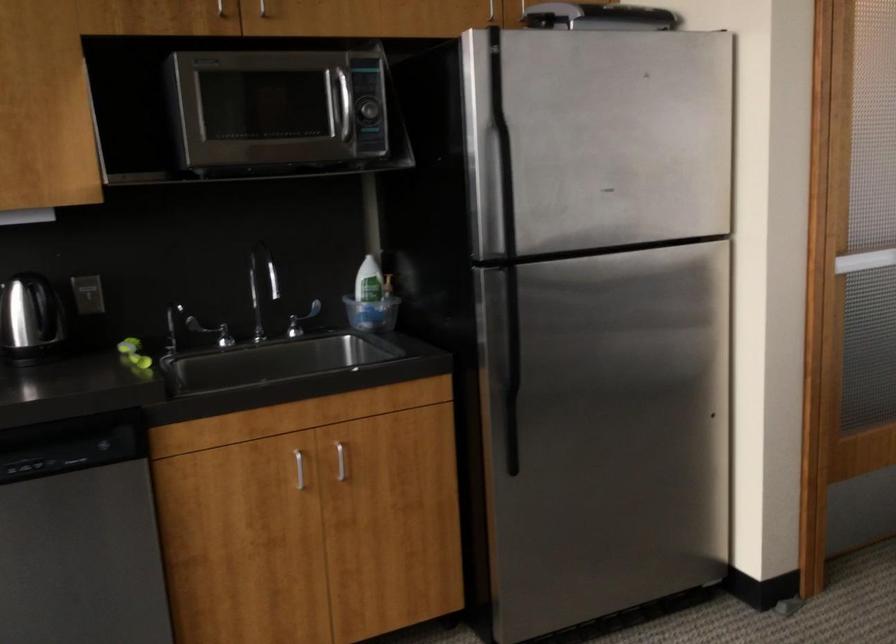
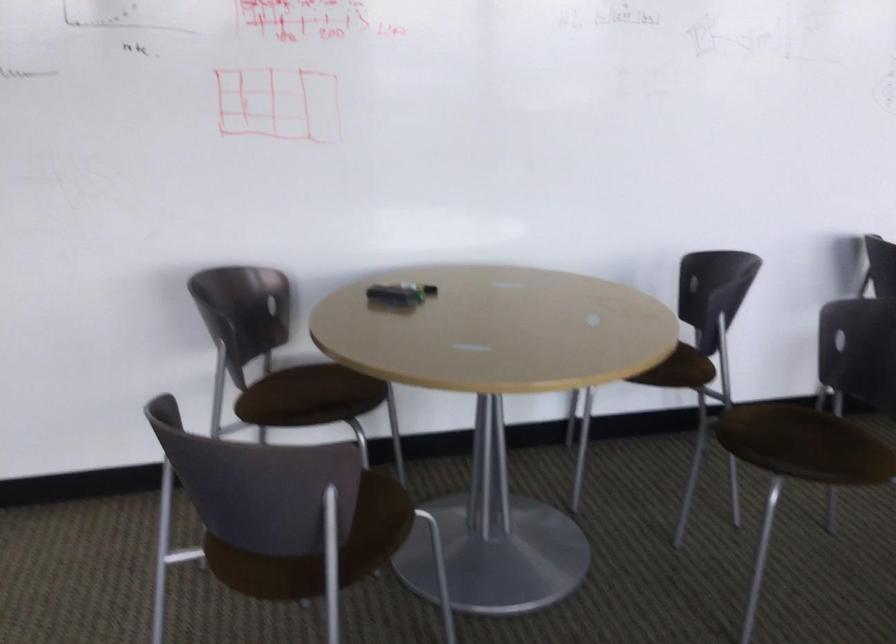
Question: The camera is either moving clockwise (left) or counter-clockwise (right) around the object. The first image is from the beginning of the video and the second image is from the end. Is the camera moving left or right when shooting the video?

Choices:
 (A) Left
 (B) Right

Answer: (A)